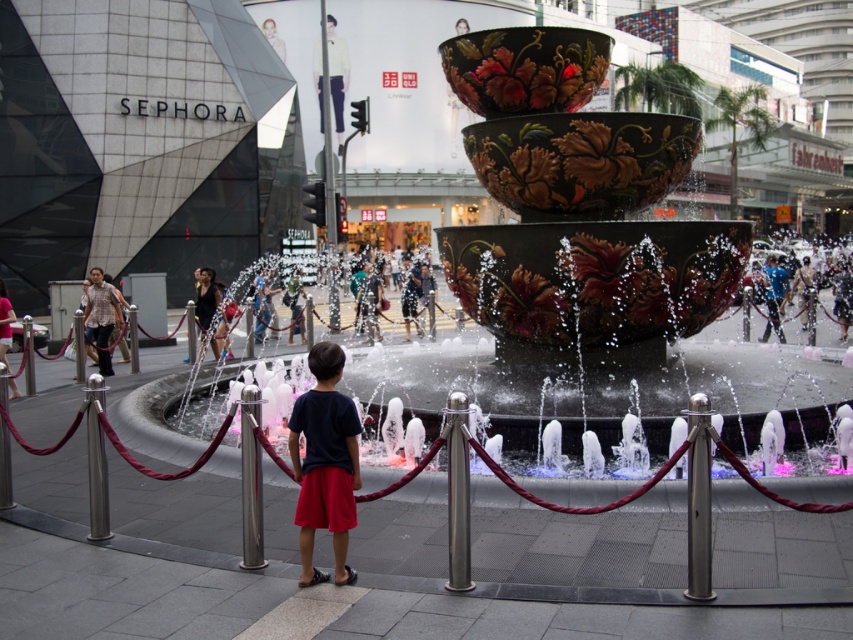
Question: Estimate the real-world distances between objects in this image. Which object is farther from the dark blue fabric shirt at center?

Choices:
 (A) brushed metal pole at center
 (B) matte black shirt at left

Answer: (B)

Question: Which object is closer to the camera taking this photo?

Choices:
 (A) blue fabric shirt at center
 (B) brushed metal pole at center
 (C) silver metallic pole at lower left
 (D) black matte swimsuit at center

Answer: (B)

Question: Observing the image, what is the correct spatial positioning of stainless steel post at center in reference to matte black shirt at left?

Choices:
 (A) left
 (B) right

Answer: (B)

Question: Is black matte swimsuit at center in front of smooth white shirt at upper center?

Choices:
 (A) no
 (B) yes

Answer: (B)

Question: Is brushed metal pole at center in front of light beige fabric pants at upper center?

Choices:
 (A) no
 (B) yes

Answer: (B)

Question: Which point is closer to the camera taking this photo?

Choices:
 (A) (276, 44)
 (B) (97, 472)
 (C) (341, 120)
 (D) (242, 428)

Answer: (D)